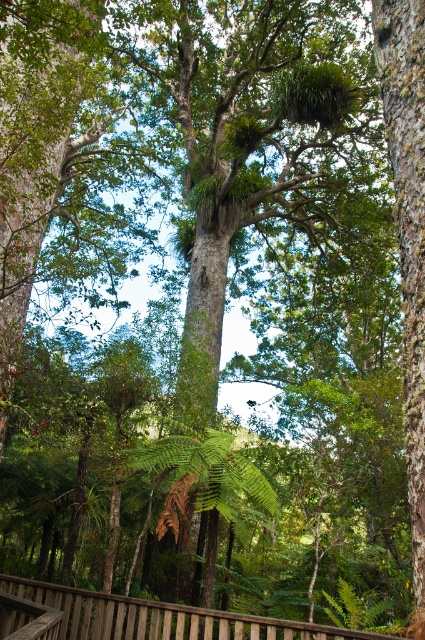
Question: Which is nearer to the green leafy fern at center?

Choices:
 (A) brown wooden rail at lower center
 (B) rough bark tree at right

Answer: (A)

Question: Considering the relative positions of rough bark tree at right and green leafy fern at center in the image provided, where is rough bark tree at right located with respect to green leafy fern at center?

Choices:
 (A) right
 (B) left

Answer: (A)

Question: Which point appears farthest from the camera in this image?

Choices:
 (A) (187, 448)
 (B) (104, 624)
 (C) (421, 515)

Answer: (B)

Question: Is rough bark tree at right bigger than brown wooden rail at lower center?

Choices:
 (A) no
 (B) yes

Answer: (A)

Question: Is brown wooden rail at lower center to the left of green leafy fern at center from the viewer's perspective?

Choices:
 (A) no
 (B) yes

Answer: (B)

Question: Which is nearer to the rough bark tree at right?

Choices:
 (A) green leafy fern at center
 (B) brown wooden rail at lower center

Answer: (A)